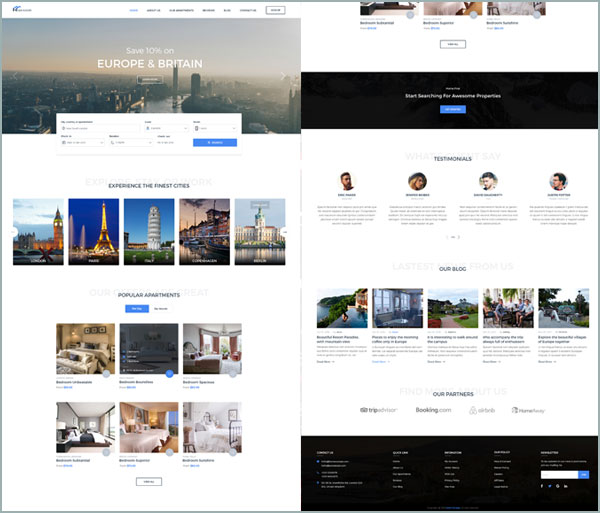
At what (x,y) coordinates should I click in order to perform the action: click on photo of bed. Please return your answer as a coordinate pair (x, y). Looking at the image, I should click on (72, 429), (72, 355), (134, 426), (148, 356), (207, 348), (210, 427).